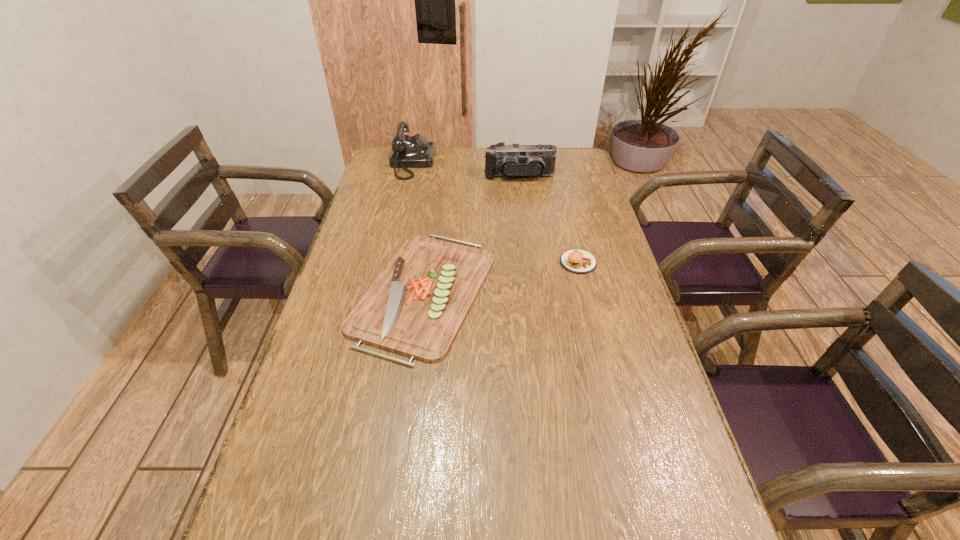
The height and width of the screenshot is (540, 960). In order to click on telephone located in the left edge section of the desktop in this screenshot , I will do `click(416, 151)`.

Locate an element on the screen. chopping board located in the left edge section of the desktop is located at coordinates click(x=417, y=305).

Identify the location of camcorder that is at the right edge. (534, 161).

This screenshot has width=960, height=540. I want to click on patty that is at the right edge, so click(x=578, y=261).

Where is `object located at the far left corner`? The image size is (960, 540). object located at the far left corner is located at coordinates (416, 151).

I want to click on object positioned at the far right corner, so click(x=534, y=161).

Locate an element on the screen. The height and width of the screenshot is (540, 960). free space at the far edge of the desktop is located at coordinates (480, 173).

The width and height of the screenshot is (960, 540). Find the location of `free space at the left edge of the desktop`. free space at the left edge of the desktop is located at coordinates [x=338, y=433].

This screenshot has height=540, width=960. Find the location of `free space at the right edge of the desktop`. free space at the right edge of the desktop is located at coordinates (594, 204).

The width and height of the screenshot is (960, 540). I want to click on free space at the far left corner of the desktop, so click(x=372, y=169).